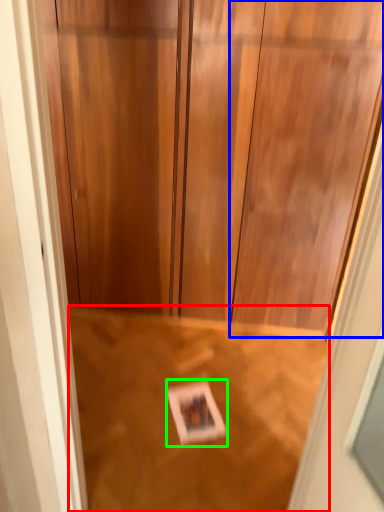
Question: Which is nearer to the plywood (highlighted by a red box)? door (highlighted by a blue box) or postcard (highlighted by a green box).

Choices:
 (A) door
 (B) postcard

Answer: (B)